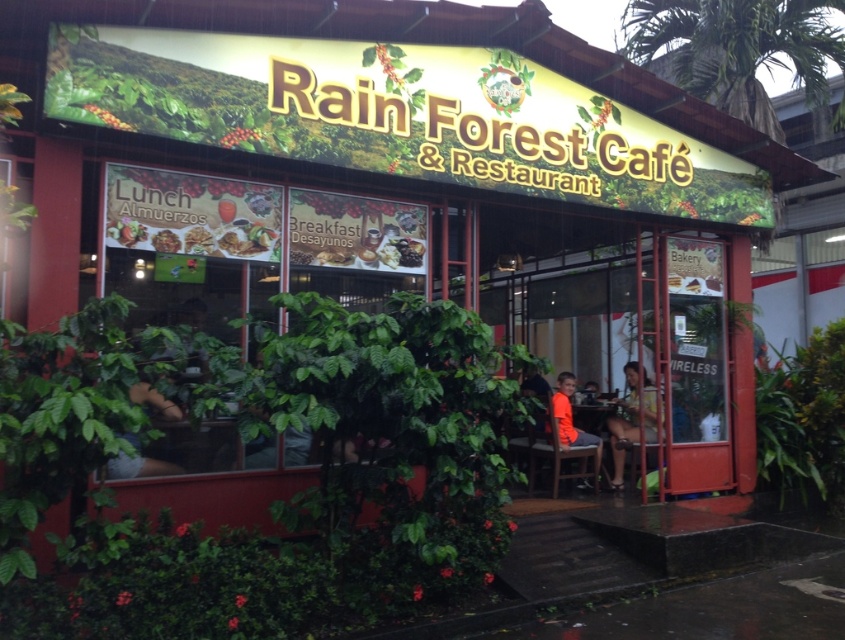
Question: Which point is closer to the camera taking this photo?

Choices:
 (A) (613, 458)
 (B) (595, 484)
 (C) (143, 388)

Answer: (C)

Question: Which object is the closest to the smooth glossy coffee bean at center?

Choices:
 (A) wooden table at center
 (B) smooth white plate at center

Answer: (B)

Question: Is yellow floral shirt at center below smooth white plate at center?

Choices:
 (A) yes
 (B) no

Answer: (A)

Question: Is yellow floral shirt at center positioned at the back of matte brown bread at center?

Choices:
 (A) yes
 (B) no

Answer: (A)

Question: Which point is farther to the camera?

Choices:
 (A) (581, 426)
 (B) (123, 227)
 (C) (350, 259)

Answer: (A)

Question: Is wooden table at center above smooth glossy coffee bean at center?

Choices:
 (A) no
 (B) yes

Answer: (A)